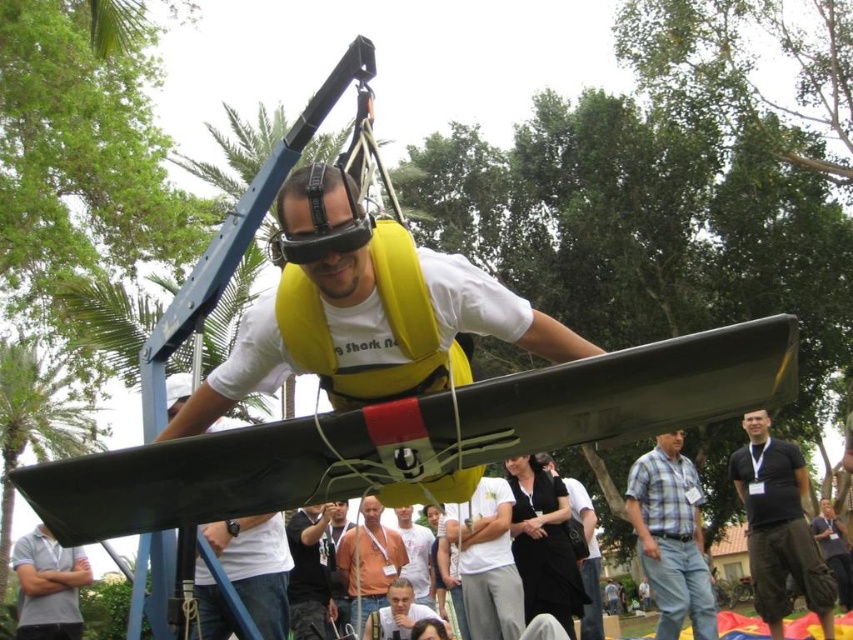
You are a photographer at the event and want to capture a clear photo of both the brown fabric shirt at center and the light brown leather jacket at lower center. Which object should you focus on first to ensure both are in focus?

You should focus on the brown fabric shirt at center first because it is closer to you than the light brown leather jacket at lower center. By focusing on the closer object, the farther one will also be in focus due to the depth of field.

You are a photographer at the event and want to capture a photo of the person participating in the flight simulation. Since you can only focus on one clothing item at a time, which clothing item should you focus on to ensure the dark blue jeans at center and white shirt at center are both in the frame?

You should focus on the white shirt at center because dark blue jeans at center is to the left of white shirt at center, so focusing on the white shirt at center will include both items in the frame.